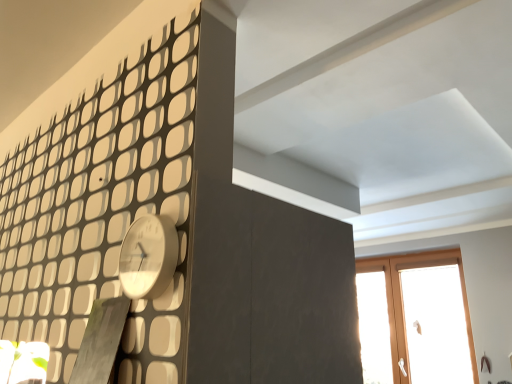
In order to click on white glossy clock at upper left in this screenshot , I will do `click(148, 257)`.

Describe the element at coordinates (148, 257) in the screenshot. I see `white glossy clock at upper left` at that location.

What is the approximate width of white glossy clock at upper left?

It is 1.51 inches.

Find the location of a particular element. Image resolution: width=512 pixels, height=384 pixels. wooden window at upper right is located at coordinates point(405,305).

What do you see at coordinates (405, 305) in the screenshot? Image resolution: width=512 pixels, height=384 pixels. I see `wooden window at upper right` at bounding box center [405, 305].

The image size is (512, 384). Identify the location of white glossy clock at upper left. (148, 257).

Which object is positioned more to the left, wooden window at upper right or white glossy clock at upper left?

white glossy clock at upper left.

Which object is further away from the camera taking this photo, wooden window at upper right or white glossy clock at upper left?

wooden window at upper right is behind.

Does point (465, 298) appear closer or farther from the camera than point (126, 284)?

Point (465, 298).

From the image's perspective, is wooden window at upper right located beneath white glossy clock at upper left?

Yes, from the image's perspective, wooden window at upper right is beneath white glossy clock at upper left.

From a real-world perspective, which is physically above, wooden window at upper right or white glossy clock at upper left?

In real-world perspective, white glossy clock at upper left is above.

Does wooden window at upper right have a lesser width compared to white glossy clock at upper left?

Incorrect, the width of wooden window at upper right is not less than that of white glossy clock at upper left.

Considering the sizes of objects wooden window at upper right and white glossy clock at upper left in the image provided, who is taller, wooden window at upper right or white glossy clock at upper left?

With more height is wooden window at upper right.

Is wooden window at upper right bigger than white glossy clock at upper left?

Yes.

Is white glossy clock at upper left surrounded by wooden window at upper right?

No.

Consider the image. Does wooden window at upper right touch white glossy clock at upper left?

They are not placed beside each other.

Is wooden window at upper right aimed at white glossy clock at upper left?

Yes, wooden window at upper right is facing white glossy clock at upper left.

At what (x,y) coordinates should I click in order to perform the action: click on clock lying on the left of wooden window at upper right. Please return your answer as a coordinate pair (x, y). The image size is (512, 384). Looking at the image, I should click on (148, 257).

Which is more to the left, white glossy clock at upper left or wooden window at upper right?

white glossy clock at upper left is more to the left.

From the picture: Does white glossy clock at upper left lie behind wooden window at upper right?

No, white glossy clock at upper left is closer to the camera.

Does point (160, 219) appear closer or farther from the camera than point (459, 269)?

Clearly, point (160, 219) is closer to the camera than point (459, 269).

From the image's perspective, which object appears higher, white glossy clock at upper left or wooden window at upper right?

white glossy clock at upper left is shown above in the image.

From a real-world perspective, which object rests below the other?

From a 3D spatial view, wooden window at upper right is below.

Considering the sizes of white glossy clock at upper left and wooden window at upper right in the image, is white glossy clock at upper left wider or thinner than wooden window at upper right?

Considering their sizes, white glossy clock at upper left looks slimmer than wooden window at upper right.

Does white glossy clock at upper left have a greater height compared to wooden window at upper right?

Incorrect, the height of white glossy clock at upper left is not larger of that of wooden window at upper right.

Considering the sizes of white glossy clock at upper left and wooden window at upper right in the image, is white glossy clock at upper left bigger or smaller than wooden window at upper right?

Considering their sizes, white glossy clock at upper left takes up less space than wooden window at upper right.

Is wooden window at upper right surrounded by white glossy clock at upper left?

No, wooden window at upper right is not inside white glossy clock at upper left.

Is white glossy clock at upper left not close to wooden window at upper right?

Indeed, white glossy clock at upper left is not near wooden window at upper right.

Could you tell me if white glossy clock at upper left is turned towards wooden window at upper right?

No, white glossy clock at upper left is not aimed at wooden window at upper right.

How different are the orientations of white glossy clock at upper left and wooden window at upper right in degrees?

0.0131 degrees.

The image size is (512, 384). I want to click on clock in front of the wooden window at upper right, so click(x=148, y=257).

This screenshot has height=384, width=512. What are the coordinates of `window that appears below the white glossy clock at upper left (from a real-world perspective)` in the screenshot? It's located at (405, 305).

Locate an element on the screen. This screenshot has height=384, width=512. clock on the left of the wooden window at upper right is located at coordinates (148, 257).